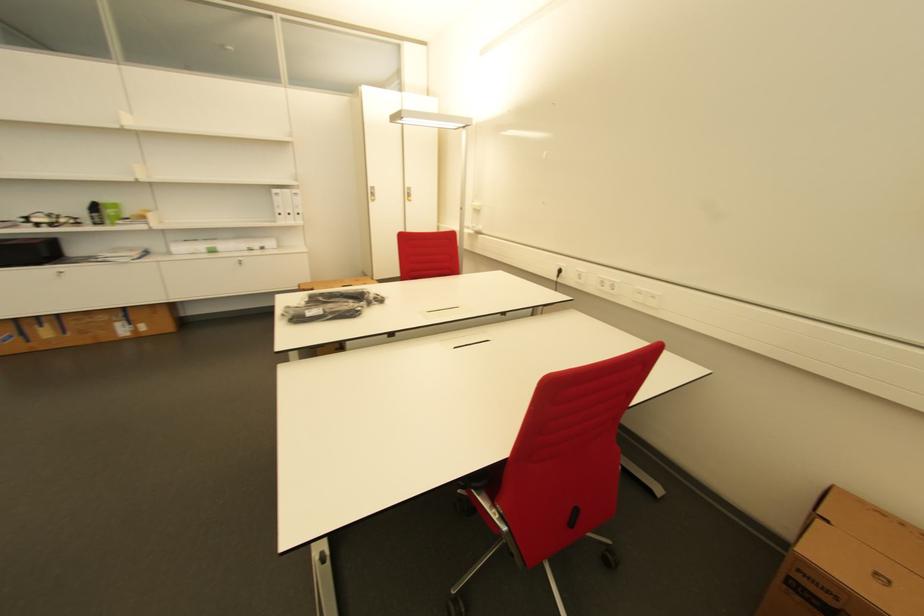
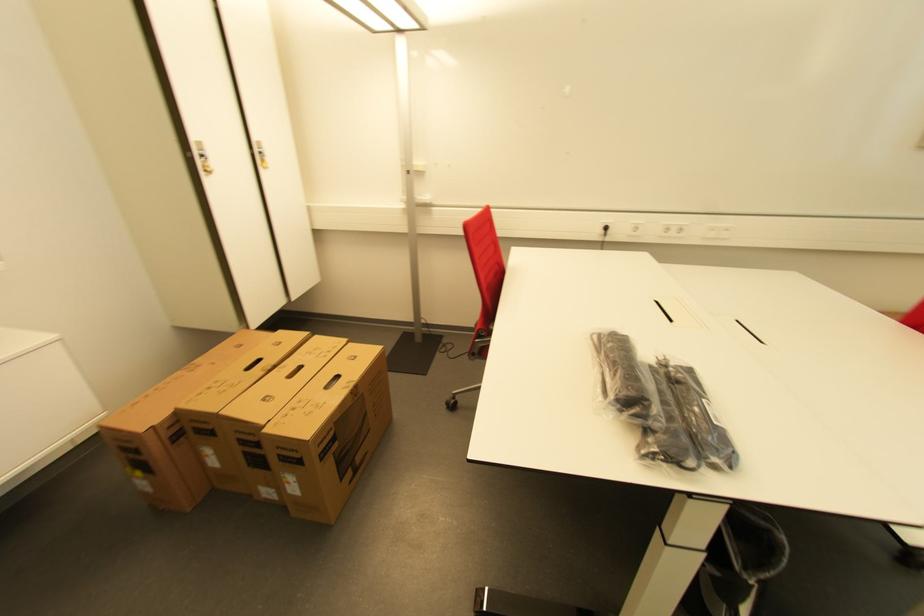
The point at (612, 289) is marked in the first image. Where is the corresponding point in the second image?

(676, 233)